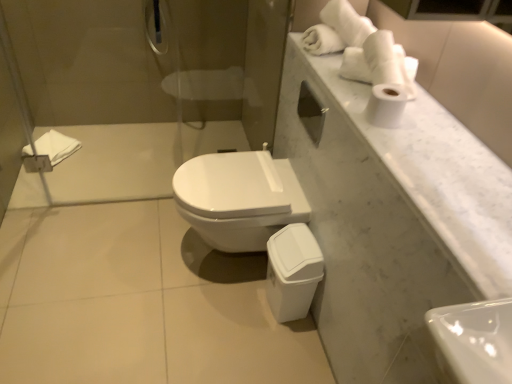
Question: From the image's perspective, is glossy metallic showerhead at upper center on white matte toilet paper at upper right?

Choices:
 (A) no
 (B) yes

Answer: (B)

Question: Can you see glossy metallic showerhead at upper center touching white matte toilet paper at upper right?

Choices:
 (A) no
 (B) yes

Answer: (A)

Question: Can you confirm if glossy metallic showerhead at upper center is thinner than white matte toilet paper at upper right?

Choices:
 (A) no
 (B) yes

Answer: (A)

Question: Considering the relative sizes of glossy metallic showerhead at upper center and white matte toilet paper at upper right in the image provided, is glossy metallic showerhead at upper center shorter than white matte toilet paper at upper right?

Choices:
 (A) yes
 (B) no

Answer: (B)

Question: Can you confirm if glossy metallic showerhead at upper center is bigger than white matte toilet paper at upper right?

Choices:
 (A) yes
 (B) no

Answer: (A)

Question: From the image's perspective, is glossy metallic showerhead at upper center under white matte toilet paper at upper right?

Choices:
 (A) no
 (B) yes

Answer: (A)

Question: Does white marble countertop at upper right have a greater width compared to glossy metallic showerhead at upper center?

Choices:
 (A) yes
 (B) no

Answer: (A)

Question: Is white marble countertop at upper right facing towards glossy metallic showerhead at upper center?

Choices:
 (A) no
 (B) yes

Answer: (A)

Question: Are white marble countertop at upper right and glossy metallic showerhead at upper center far apart?

Choices:
 (A) yes
 (B) no

Answer: (A)

Question: Considering the relative sizes of white marble countertop at upper right and glossy metallic showerhead at upper center in the image provided, is white marble countertop at upper right bigger than glossy metallic showerhead at upper center?

Choices:
 (A) yes
 (B) no

Answer: (A)

Question: From the image's perspective, is white marble countertop at upper right located beneath glossy metallic showerhead at upper center?

Choices:
 (A) no
 (B) yes

Answer: (B)

Question: Is white marble countertop at upper right beside glossy metallic showerhead at upper center?

Choices:
 (A) no
 (B) yes

Answer: (A)

Question: Considering the relative positions of white matte toilet paper at upper right and white glossy toilet at center in the image provided, is white matte toilet paper at upper right in front of white glossy toilet at center?

Choices:
 (A) yes
 (B) no

Answer: (A)